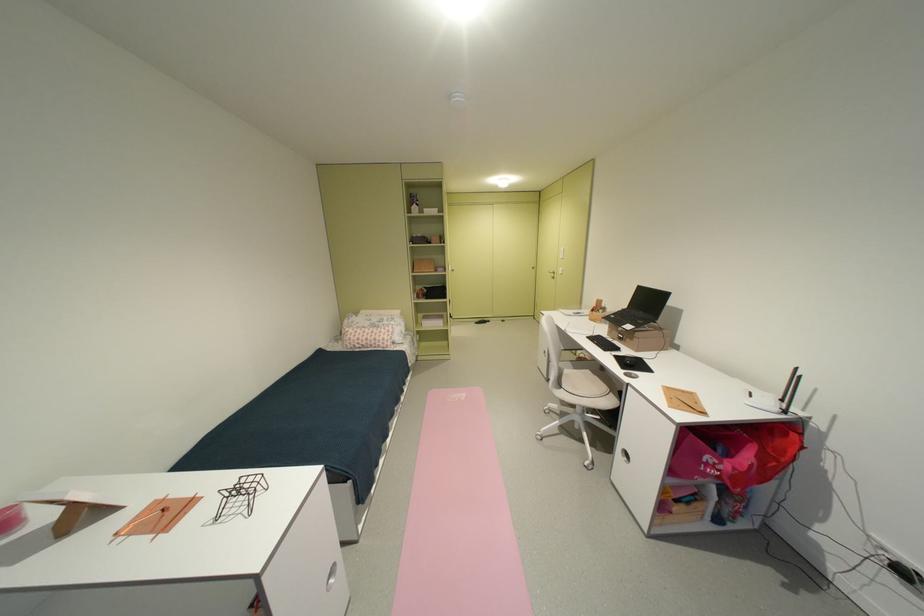
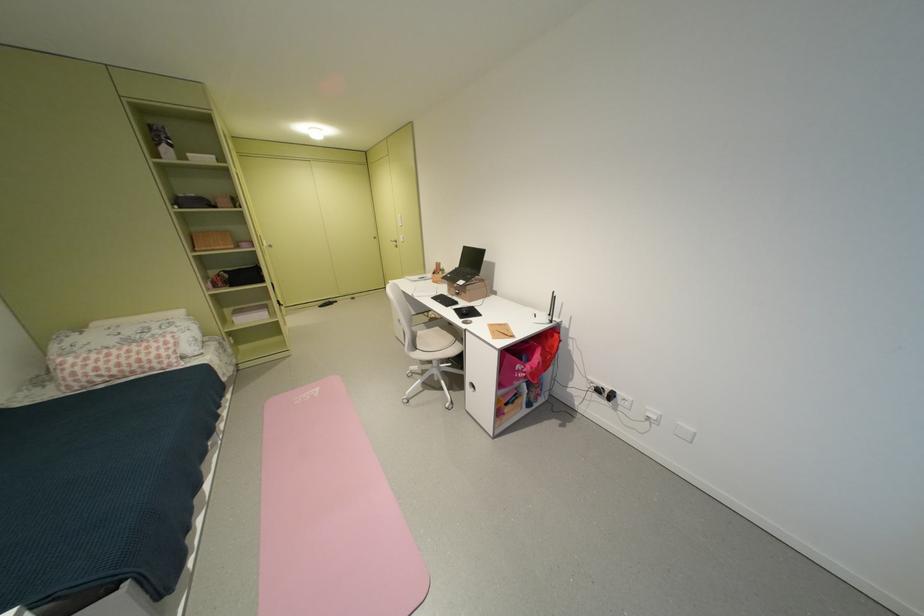
Find the pixel in the second image that matches (x=457, y=400) in the first image.

(305, 403)